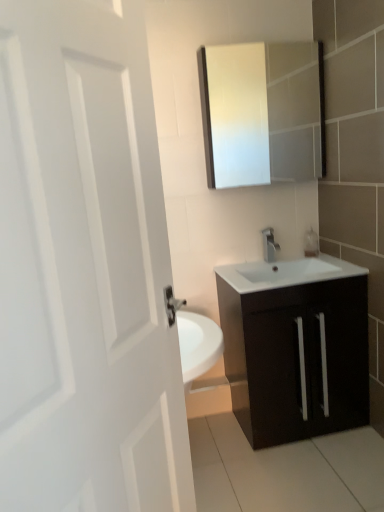
The height and width of the screenshot is (512, 384). What are the coordinates of `free space in front of clear glass soap dispenser at right` in the screenshot? It's located at (315, 264).